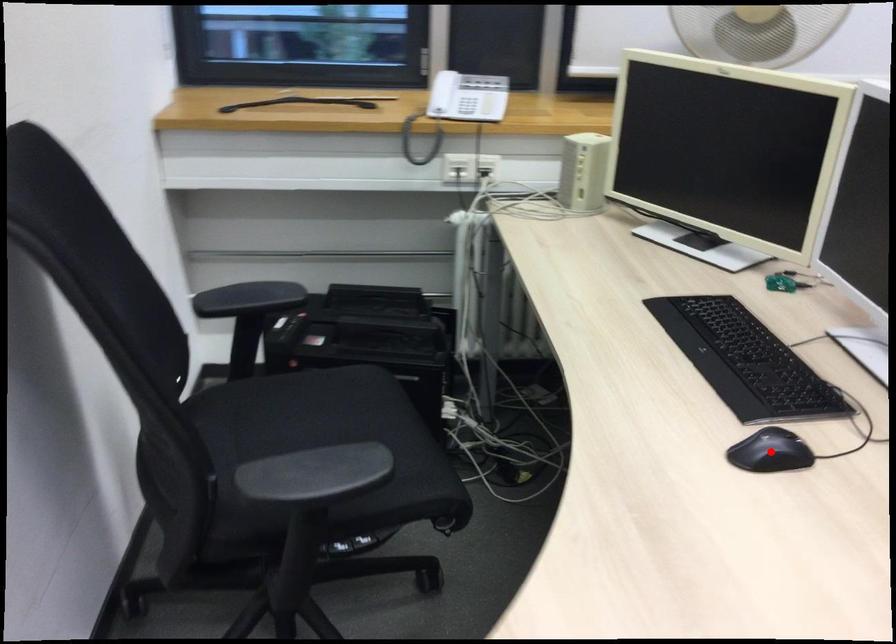
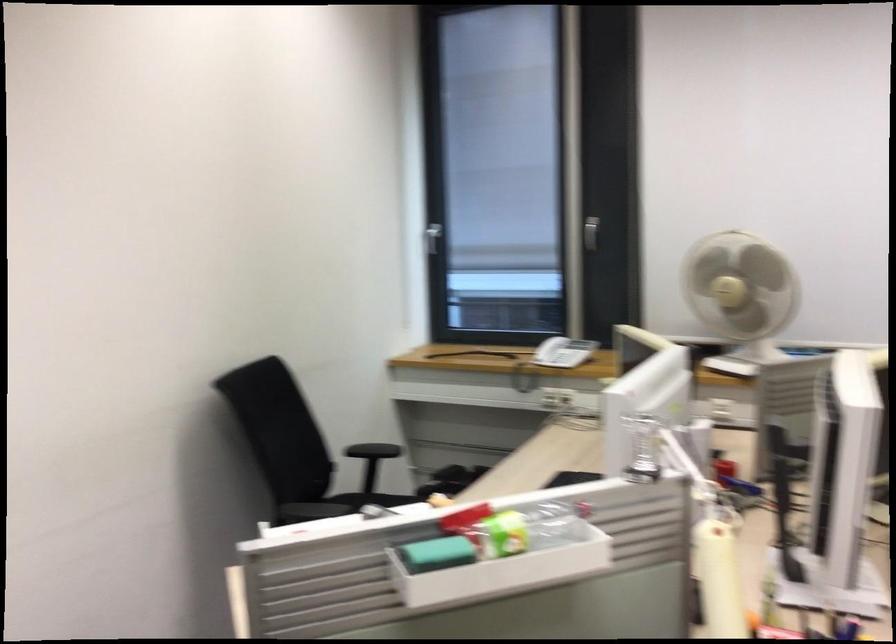
Question: I am providing you with two images of the same scene from different viewpoints. A red point is marked on the first image. Is the red point's position out of view in image 2?

Choices:
 (A) Yes
 (B) No

Answer: (A)